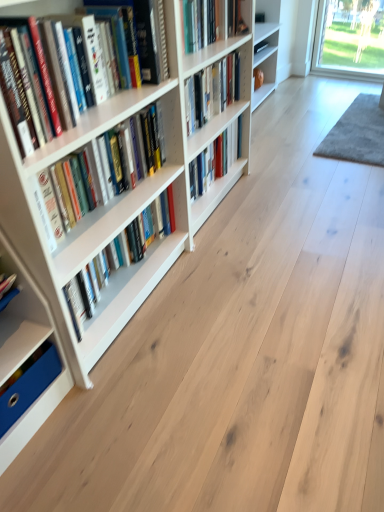
Question: Is white matte bookcase at left facing away from hardcover books at left, which ranks as the fourth book in bottom-to-top order?

Choices:
 (A) yes
 (B) no

Answer: (A)

Question: Is the depth of white matte bookcase at left less than that of hardcover books at left, which ranks as the fourth book in bottom-to-top order?

Choices:
 (A) no
 (B) yes

Answer: (B)

Question: Can you confirm if white matte bookcase at left is bigger than hardcover books at left, the second book from the top?

Choices:
 (A) no
 (B) yes

Answer: (B)

Question: From the image's perspective, is white matte bookcase at left below hardcover books at left, which ranks as the fourth book in bottom-to-top order?

Choices:
 (A) yes
 (B) no

Answer: (A)

Question: Can you confirm if white matte bookcase at left is positioned to the right of hardcover books at left, the second book from the top?

Choices:
 (A) yes
 (B) no

Answer: (A)

Question: Is white matte bookcase at left in front of or behind hardcover books at left, which is counted as the second book, starting from the bottom, in the image?

Choices:
 (A) behind
 (B) front

Answer: (B)

Question: Is white matte bookcase at left spatially inside hardcover books at left, which is counted as the second book, starting from the bottom, or outside of it?

Choices:
 (A) outside
 (B) inside

Answer: (A)

Question: Is white matte bookcase at left to the left or to the right of hardcover books at left, which is counted as the second book, starting from the bottom, in the image?

Choices:
 (A) left
 (B) right

Answer: (B)

Question: Based on their sizes in the image, would you say white matte bookcase at left is bigger or smaller than hardcover books at left, which is the 4th book in top-to-bottom order?

Choices:
 (A) big
 (B) small

Answer: (A)

Question: Based on their sizes in the image, would you say hardcover book at center, which is the 3th book from bottom to top, is bigger or smaller than white matte bookshelf at left?

Choices:
 (A) big
 (B) small

Answer: (B)

Question: Considering the positions of point (208, 181) and point (44, 298), is point (208, 181) closer or farther from the camera than point (44, 298)?

Choices:
 (A) farther
 (B) closer

Answer: (A)

Question: From their relative heights in the image, would you say hardcover book at center, which ranks as the third book in top-to-bottom order, is taller or shorter than white matte bookshelf at left?

Choices:
 (A) short
 (B) tall

Answer: (A)

Question: Is hardcover book at center, which ranks as the third book in top-to-bottom order, wider or thinner than white matte bookshelf at left?

Choices:
 (A) thin
 (B) wide

Answer: (A)

Question: Is hardcover book at center, acting as the 1th book starting from the top, to the left or to the right of white matte bookshelf at left in the image?

Choices:
 (A) right
 (B) left

Answer: (A)

Question: Relative to white matte bookshelf at left, is hardcover book at center, acting as the fifth book starting from the bottom, in front or behind?

Choices:
 (A) front
 (B) behind

Answer: (B)